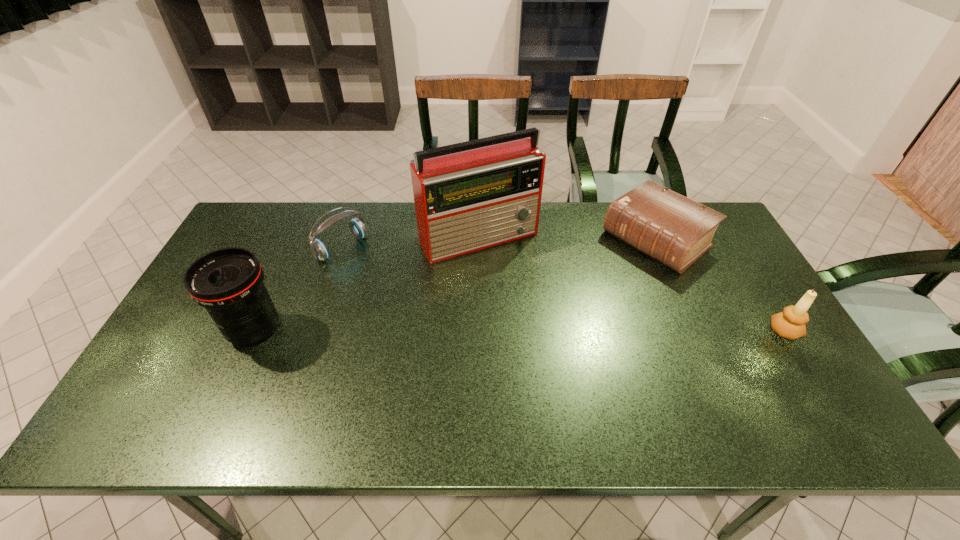
Where is `vacant space located on the spine side of the Bible`? vacant space located on the spine side of the Bible is located at coordinates (535, 330).

The width and height of the screenshot is (960, 540). I want to click on vacant space located 0.300m on the ear cups of the headset, so click(x=421, y=309).

The image size is (960, 540). I want to click on vacant space located 0.200m on the ear cups of the headset, so pos(397,292).

The height and width of the screenshot is (540, 960). I want to click on free spot located 0.170m on the ear cups of the headset, so click(x=392, y=286).

The height and width of the screenshot is (540, 960). Identify the location of vacant area located on the front-facing side of the tallest object. (562, 348).

This screenshot has height=540, width=960. In order to click on free location located 0.380m on the front-facing side of the tallest object in this screenshot , I will do `click(567, 356)`.

Where is `free space located 0.130m on the front-facing side of the tallest object`? This screenshot has height=540, width=960. free space located 0.130m on the front-facing side of the tallest object is located at coordinates (522, 290).

I want to click on Bible present at the far edge, so click(676, 231).

Where is `headset at the far edge`? Image resolution: width=960 pixels, height=540 pixels. headset at the far edge is located at coordinates (319, 250).

The image size is (960, 540). Find the location of `radio receiver present at the far edge`. radio receiver present at the far edge is located at coordinates (468, 196).